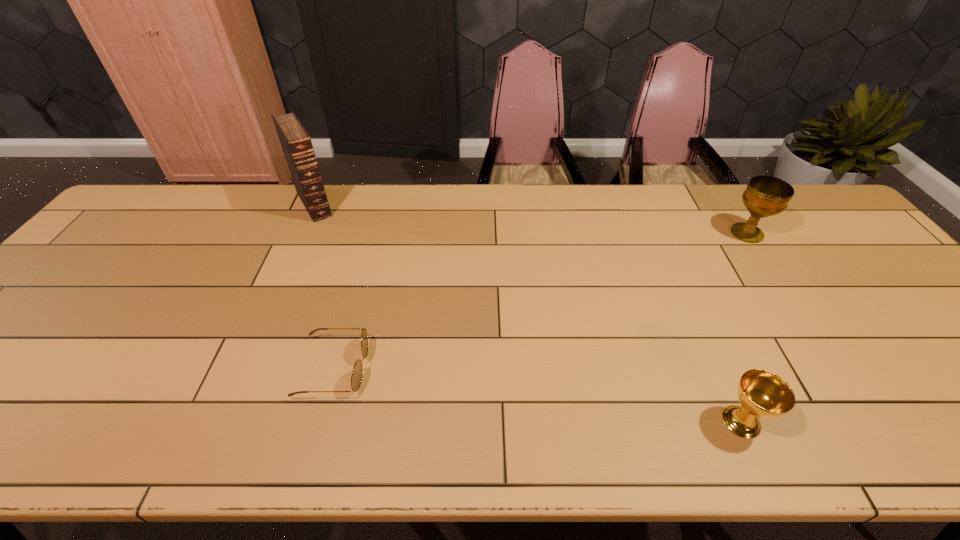
This screenshot has width=960, height=540. What are the coordinates of `free location located 0.110m on the right of the second object from right to left` in the screenshot? It's located at (818, 422).

Locate an element on the screen. This screenshot has height=540, width=960. vacant position located 0.330m on the lenses of the third object from right to left is located at coordinates (514, 368).

Image resolution: width=960 pixels, height=540 pixels. In order to click on Bible at the far edge in this screenshot , I will do `click(296, 143)`.

Image resolution: width=960 pixels, height=540 pixels. I want to click on chalice that is at the far edge, so click(x=765, y=196).

At what (x,y) coordinates should I click in order to perform the action: click on object situated at the near edge. Please return your answer as a coordinate pair (x, y). The width and height of the screenshot is (960, 540). Looking at the image, I should click on (763, 394).

The image size is (960, 540). In order to click on free space at the far edge in this screenshot , I will do `click(303, 221)`.

In the image, there is a desktop. At what (x,y) coordinates should I click in order to perform the action: click on vacant space at the near edge. Please return your answer as a coordinate pair (x, y). The height and width of the screenshot is (540, 960). Looking at the image, I should click on (239, 434).

Image resolution: width=960 pixels, height=540 pixels. I want to click on free space at the left edge of the desktop, so click(x=69, y=310).

This screenshot has height=540, width=960. In order to click on free space at the right edge in this screenshot , I will do `click(937, 327)`.

The height and width of the screenshot is (540, 960). In order to click on vacant space at the far left corner of the desktop in this screenshot , I will do coord(157,191).